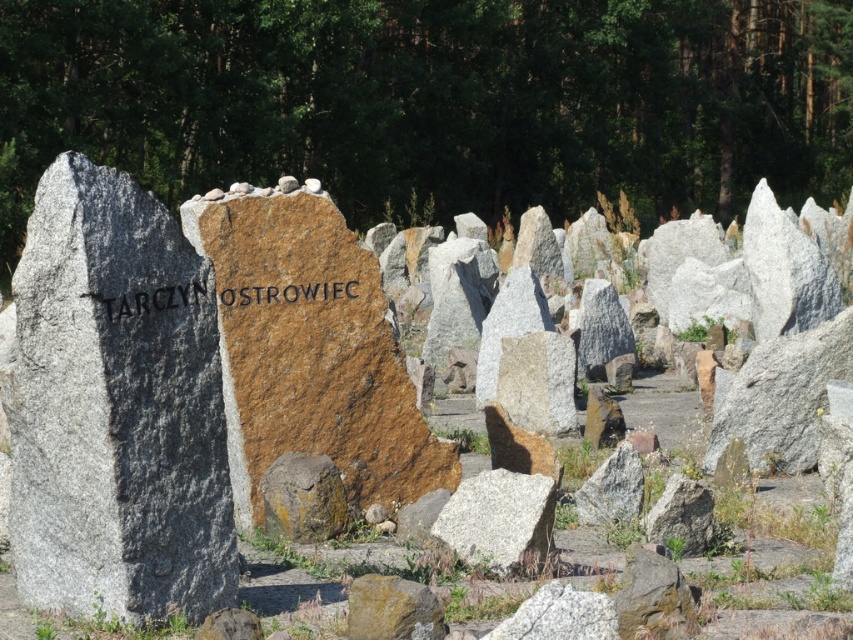
You are a geologist examining two rocks in a field. You have a ruler that can measure up to 1 meter. The brown stone at center and the white granite rock at center are both in your sight. Which rock would require you to extend your ruler beyond 50 cm to measure its height?

The brown stone at center has a greater height compared to the white granite rock at center, so the brown stone at center would require extending the ruler beyond 50 cm if its height exceeds that measurement.